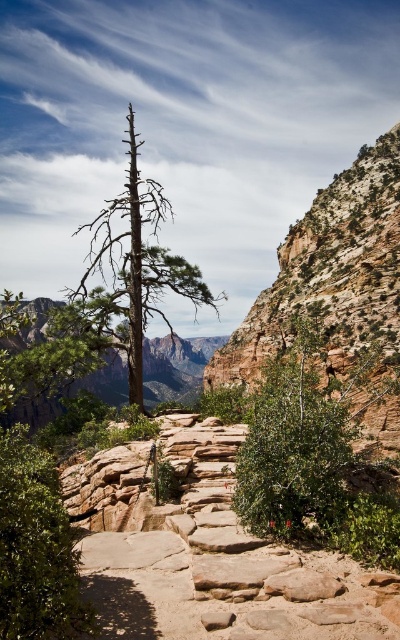
You are a hiker standing on the rocky path and want to take a photo of the green leafy tree at left and the brown textured tree at center. Which tree should you move towards to get both in the frame?

The green leafy tree at left is positioned on the right side of brown textured tree at center, so you should move towards the brown textured tree at center to capture both in the frame.

You are a hiker trying to navigate through this rugged landscape. You notice two trees ahead of you, the green leafy tree at left and the brown textured tree at center. Which tree would you need to walk around if you want to stay on the path?

The brown textured tree at center occupies more space than the green leafy tree at left, so you would need to walk around the brown textured tree at center to stay on the path.